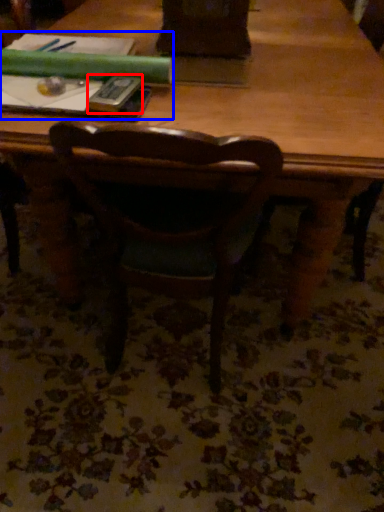
Question: Among these objects, which one is nearest to the camera, paperback book (highlighted by a red box) or book (highlighted by a blue box)?

Choices:
 (A) paperback book
 (B) book

Answer: (A)